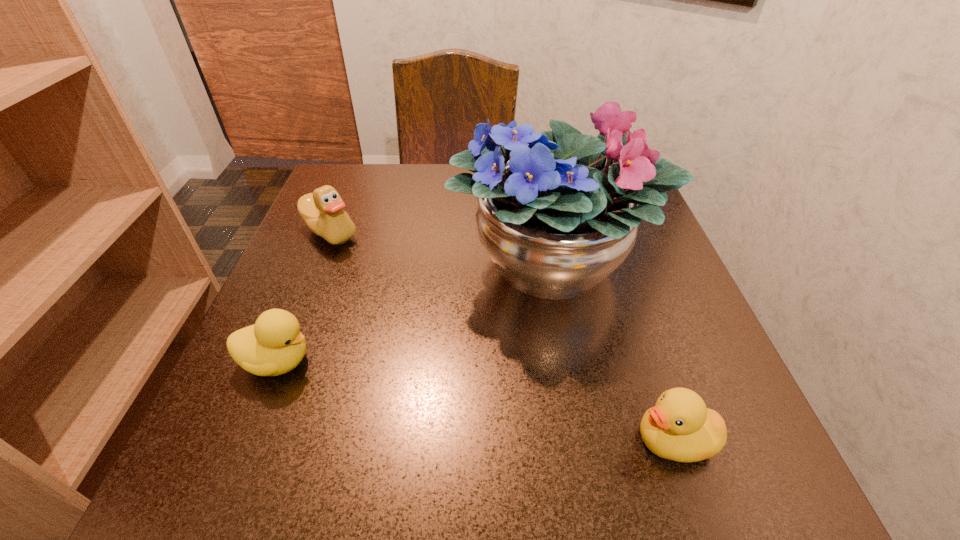
Locate an element on the screen. free space that satisfies the following two spatial constraints: 1. at the beak of the tallest object; 2. on the left side of the farthest duck is located at coordinates [317, 264].

In order to click on vacant space that satisfies the following two spatial constraints: 1. at the beak of the farthest duck; 2. on the right side of the tallest object in this screenshot , I will do `click(317, 264)`.